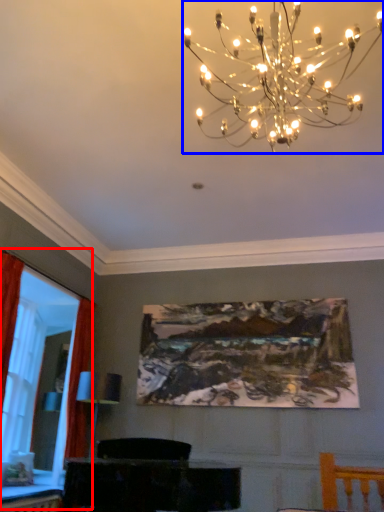
Question: Which object is closer to the camera taking this photo, bay window (highlighted by a red box) or lamp (highlighted by a blue box)?

Choices:
 (A) bay window
 (B) lamp

Answer: (B)